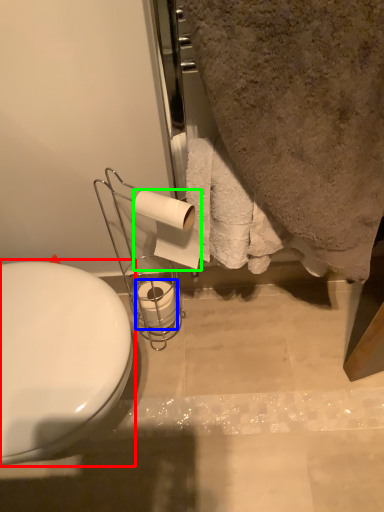
Question: Which object is the closest to the toilet (highlighted by a red box)? Choose among these: toilet paper (highlighted by a blue box) or toilet paper (highlighted by a green box).

Choices:
 (A) toilet paper
 (B) toilet paper

Answer: (B)